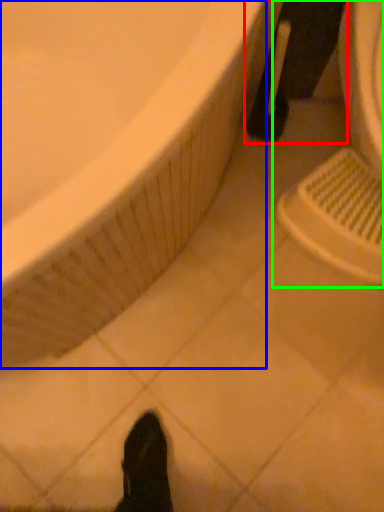
Question: Which object is the closest to the leg (highlighted by a red box)? Choose among these: bathtub (highlighted by a blue box) or sink (highlighted by a green box).

Choices:
 (A) bathtub
 (B) sink

Answer: (B)